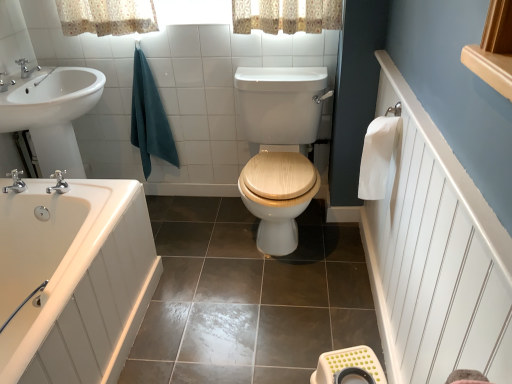
Where is `free space between wooden at center and white plastic stool at lower right`? The width and height of the screenshot is (512, 384). free space between wooden at center and white plastic stool at lower right is located at coordinates (303, 306).